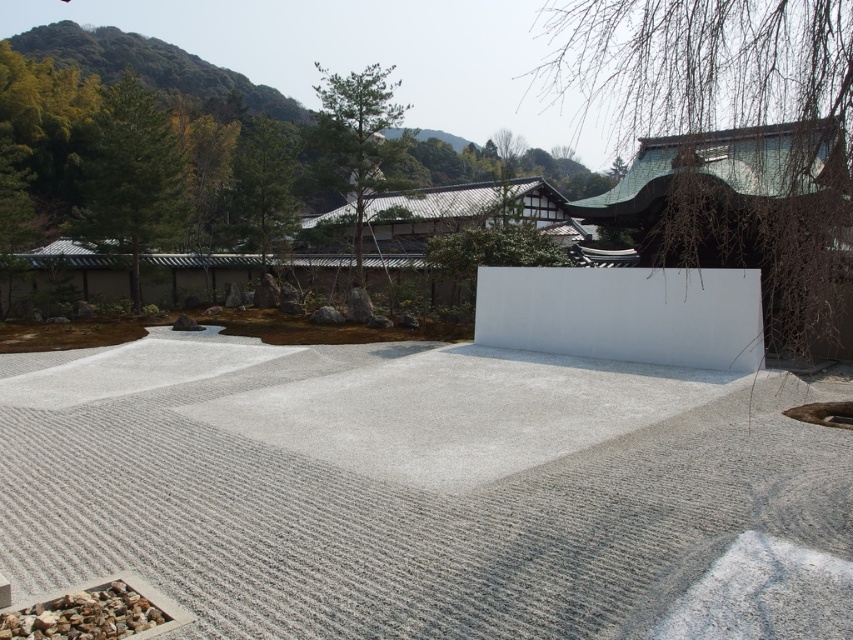
Question: Which of the following is the farthest from the observer?

Choices:
 (A) (270, 173)
 (B) (827, 96)
 (C) (160, 212)

Answer: (A)

Question: Does green leafy tree at center appear on the left side of gray gravel at lower left?

Choices:
 (A) no
 (B) yes

Answer: (B)

Question: From the image, what is the correct spatial relationship of green textured pine tree at upper left in relation to gray gravel at lower left?

Choices:
 (A) right
 (B) left

Answer: (B)

Question: Can you confirm if white smooth concrete at center is positioned above green textured pine tree at upper left?

Choices:
 (A) no
 (B) yes

Answer: (A)

Question: Which point is closer to the camera taking this photo?

Choices:
 (A) (341, 86)
 (B) (543, 291)

Answer: (B)

Question: Which of the following is the farthest from the observer?

Choices:
 (A) coord(143,630)
 (B) coord(132,296)
 (C) coord(676,360)

Answer: (B)